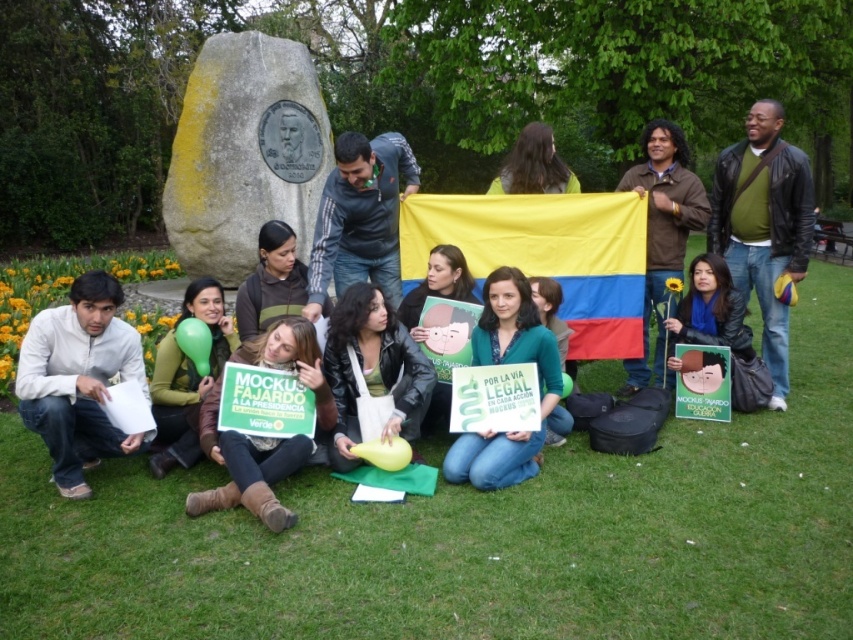
You are planning to set up a small picnic blanket in the park scene. The picnic blanket is as wide as the matte yellow shirt at upper center. Will the green grass at lower center be wide enough to accommodate the blanket without overlapping other objects?

The green grass at lower center is wider than the matte yellow shirt at upper center, so the picnic blanket will fit within the green grass area without overlapping other objects.

You are standing at the point marked by the coordinates (473, 536) in the image. What type of surface are you currently standing on?

The point marked by the coordinates (473, 536) is on the green grass at lower center.